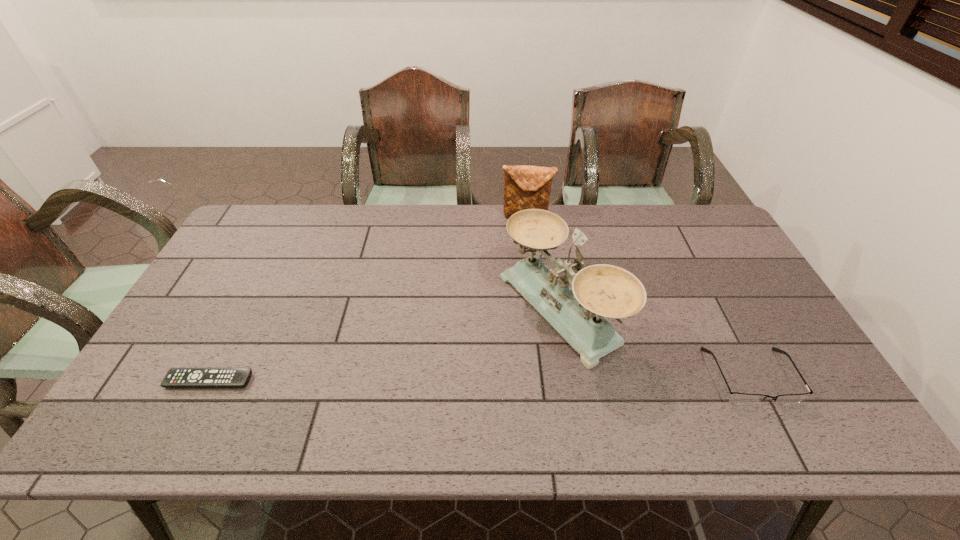
Image resolution: width=960 pixels, height=540 pixels. I want to click on object located in the near right corner section of the desktop, so pos(737,398).

Locate an element on the screen. Image resolution: width=960 pixels, height=540 pixels. vacant area at the far edge of the desktop is located at coordinates (372, 210).

This screenshot has height=540, width=960. Find the location of `vacant area at the near edge`. vacant area at the near edge is located at coordinates (262, 382).

Find the location of `vacant area at the left edge`. vacant area at the left edge is located at coordinates (242, 271).

In the image, there is a desktop. Identify the location of vacant space at the right edge. (732, 295).

Identify the location of vacant space at the far right corner of the desktop. The width and height of the screenshot is (960, 540). (712, 241).

Identify the location of free space at the near right corner. This screenshot has width=960, height=540. (828, 402).

At what (x,y) coordinates should I click in order to perform the action: click on free space between the leftmost object and the spectacles. Please return your answer as a coordinate pair (x, y). Looking at the image, I should click on (480, 379).

The height and width of the screenshot is (540, 960). I want to click on vacant region between the rightmost object and the leftmost object, so click(480, 379).

Identify the location of free area in between the leftmost object and the spectacles. point(480,379).